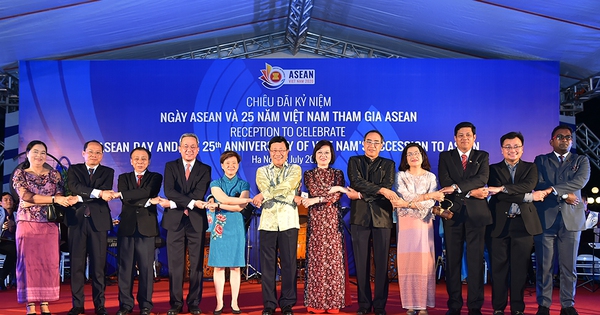
Locate an element on the screen. The width and height of the screenshot is (600, 315). ceiling is located at coordinates (465, 29), (176, 15).